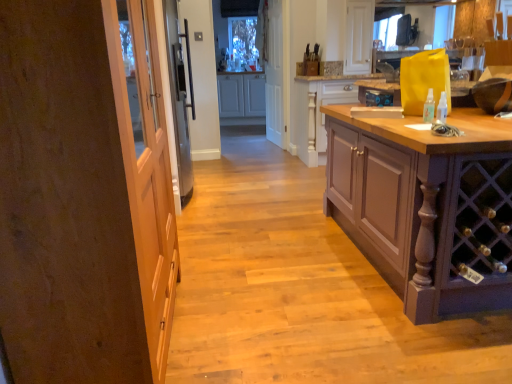
The height and width of the screenshot is (384, 512). What are the coordinates of `free point to the left of white matte screen door at center` in the screenshot? It's located at (248, 142).